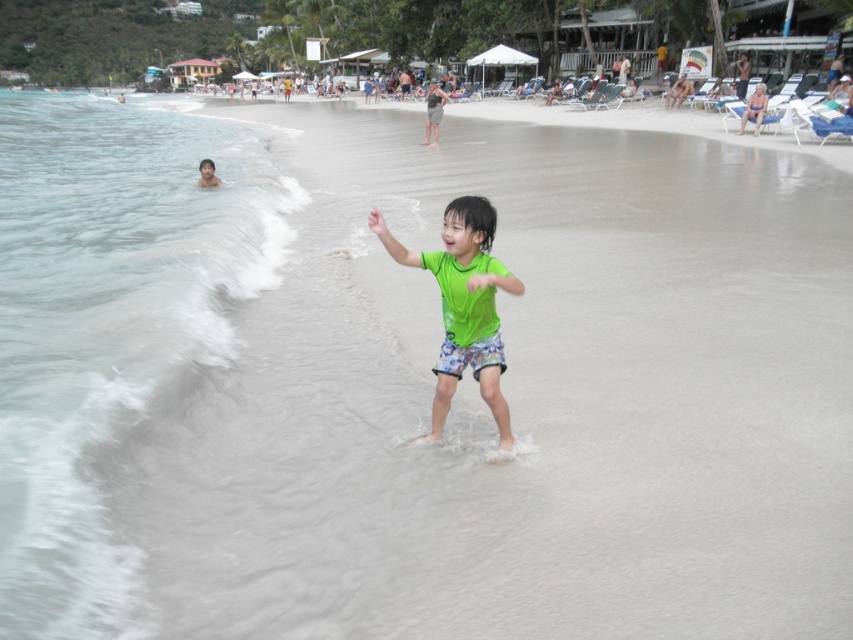
Question: Which of the following is the closest to the observer?

Choices:
 (A) (492, 342)
 (B) (86, 141)

Answer: (A)

Question: In this image, where is clear water at left located relative to green matte swimsuit at center?

Choices:
 (A) above
 (B) below

Answer: (A)

Question: Does clear water at left have a lesser width compared to green matte swimsuit at center?

Choices:
 (A) no
 (B) yes

Answer: (A)

Question: Is clear water at left bigger than green matte swimsuit at center?

Choices:
 (A) yes
 (B) no

Answer: (A)